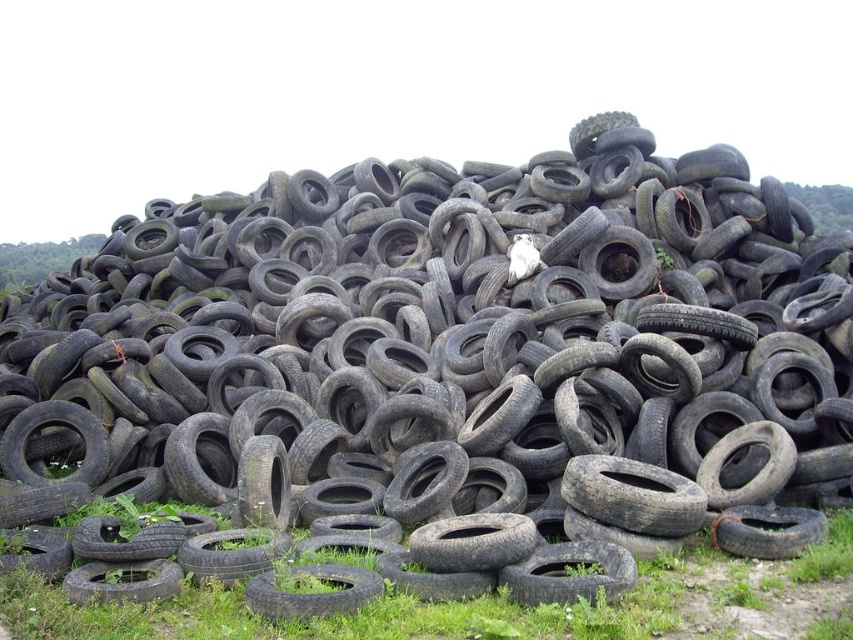
Question: Based on their relative distances, which object is nearer to the green grass at lower center?

Choices:
 (A) black rubber tire at center
 (B) black rubber tire at lower center

Answer: (B)

Question: Does green grass at lower center have a greater width compared to black rubber tire at center?

Choices:
 (A) no
 (B) yes

Answer: (B)

Question: Does black rubber tire at lower center have a larger size compared to black rubber tire at center?

Choices:
 (A) yes
 (B) no

Answer: (B)

Question: Considering the real-world distances, which object is closest to the black rubber tire at lower center?

Choices:
 (A) black rubber tire at center
 (B) green grass at lower center

Answer: (B)

Question: Based on their relative distances, which object is nearer to the black rubber tire at lower center?

Choices:
 (A) black rubber tire at center
 (B) green grass at lower center

Answer: (B)

Question: Can you confirm if black rubber tire at lower center is wider than black rubber tire at center?

Choices:
 (A) yes
 (B) no

Answer: (A)